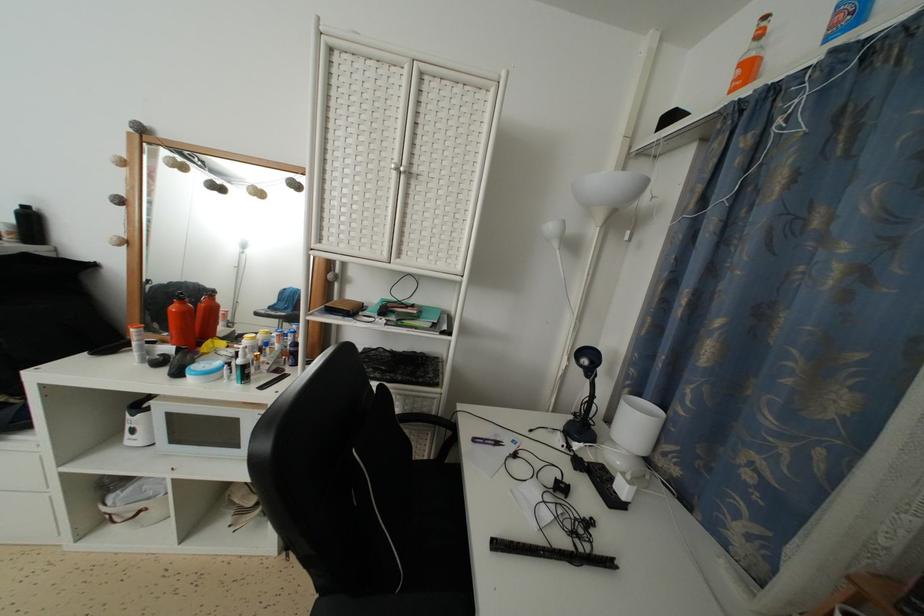
Image resolution: width=924 pixels, height=616 pixels. Describe the element at coordinates (434, 537) in the screenshot. I see `the black chair sitting surface` at that location.